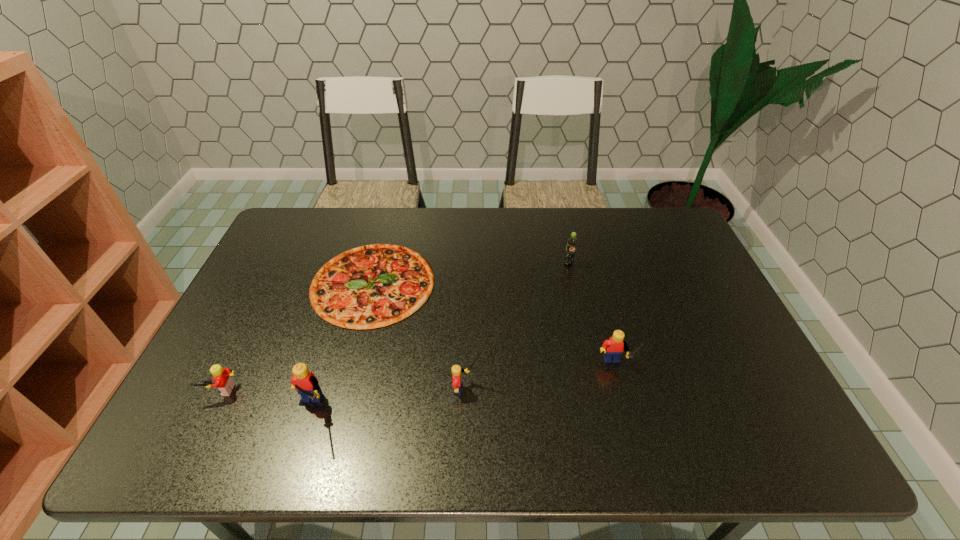
Find the location of `the second Lego from left to right`. the second Lego from left to right is located at coordinates (303, 381).

Where is `the fourth object from left to right`? the fourth object from left to right is located at coordinates (456, 369).

Locate an element on the screen. This screenshot has height=540, width=960. the third Lego from left to right is located at coordinates (456, 369).

Where is `the third shortest Lego`? This screenshot has height=540, width=960. the third shortest Lego is located at coordinates (613, 348).

Image resolution: width=960 pixels, height=540 pixels. I want to click on the fifth shortest object, so click(x=613, y=348).

The width and height of the screenshot is (960, 540). In order to click on the shortest object in this screenshot , I will do `click(371, 286)`.

Image resolution: width=960 pixels, height=540 pixels. I want to click on the second object from right to left, so click(x=572, y=242).

You are a GUI agent. You are given a task and a screenshot of the screen. Output one action in this format:
    pyautogui.click(x=<x>, y=<y>)
    Task: Click on the leftmost Lego
    The width and height of the screenshot is (960, 540).
    Given the screenshot: What is the action you would take?
    pyautogui.click(x=222, y=380)

Where is `the leftmost object`? The height and width of the screenshot is (540, 960). the leftmost object is located at coordinates (222, 380).

Locate an element on the screen. blank space located on the front-facing side of the third tallest Lego is located at coordinates (503, 389).